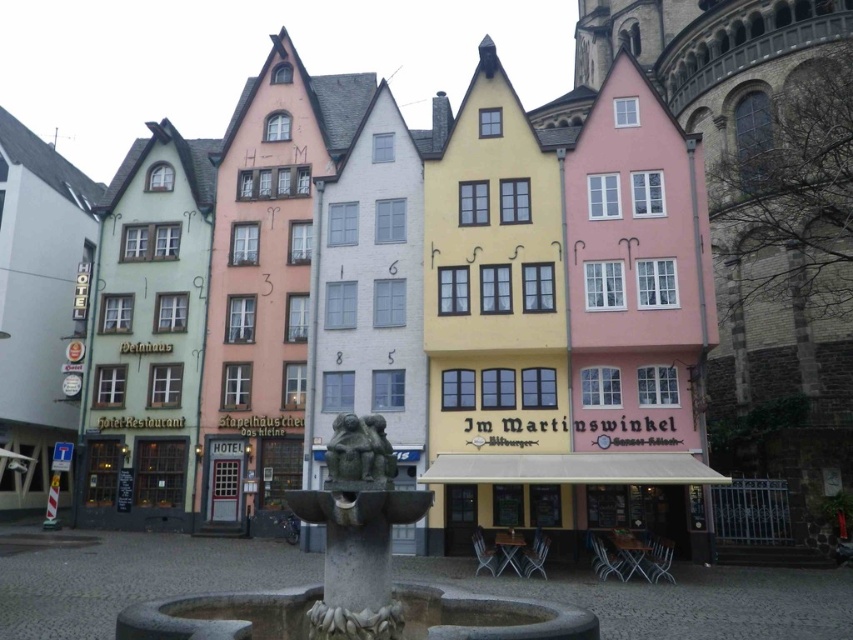
You are standing in the town square and want to find the granite fountain at center. According to the map, the fountain is located at coordinates 0.895, 0.417. Which direction should you walk to reach it?

The granite fountain at center is located at coordinates (355, 572), so you should walk towards the center of the town square to reach it.

You are a tourist standing in the town square and want to take a photo of both the granite fountain at center and the green stone statue at center. Which one should you position to your left to include both in the frame?

The granite fountain at center is to the left of the green stone statue at center, so you should position the granite fountain at center to your left side to include both in the frame.

You are a tourist standing in the town square and want to take a photo of the granite fountain at center and the green stone statue at center. Which one is positioned higher in the image?

The green stone statue at center is positioned higher than the granite fountain at center because the fountain is located below the statue.